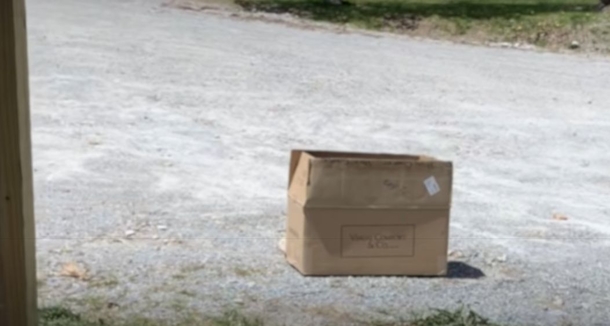
This screenshot has width=610, height=326. Identify the location of cardboard box. (327, 225).